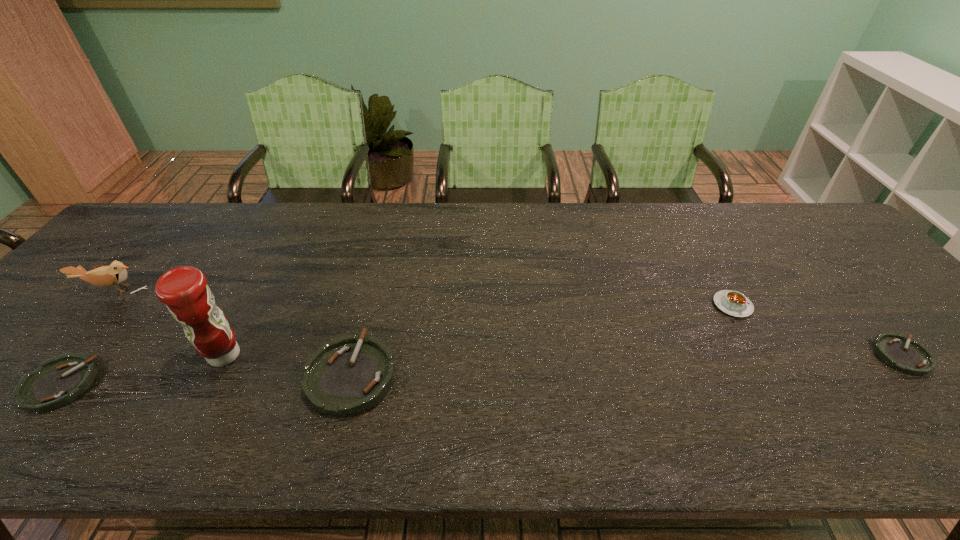
Locate an element on the screen. The width and height of the screenshot is (960, 540). free space located on the right of the leftmost ashtray is located at coordinates (175, 384).

This screenshot has height=540, width=960. What are the coordinates of `vacant space located on the back of the tallest ashtray` in the screenshot? It's located at (372, 294).

Image resolution: width=960 pixels, height=540 pixels. I want to click on free space located 0.370m on the left of the shortest object, so click(x=717, y=356).

Locate an element on the screen. vacant space located 0.310m on the back of the pudding is located at coordinates pos(685,223).

I want to click on free spot located 0.090m at the beak of the second tallest object, so pos(84,323).

Locate an element on the screen. This screenshot has width=960, height=540. free space located on the back of the condiment is located at coordinates (264, 280).

Identify the location of condiment that is positioned at the near edge. The height and width of the screenshot is (540, 960). (184, 290).

Identify the location of ashtray present at the left edge. (58, 381).

Image resolution: width=960 pixels, height=540 pixels. What are the coordinates of `bird present at the left edge` in the screenshot? It's located at (115, 274).

Locate an element on the screen. Image resolution: width=960 pixels, height=540 pixels. object that is at the right edge is located at coordinates (910, 357).